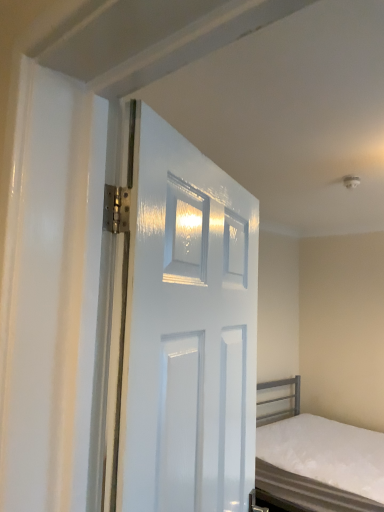
Describe the element at coordinates (186, 329) in the screenshot. I see `white glossy door at center` at that location.

Where is `white glossy door at center`? Image resolution: width=384 pixels, height=512 pixels. white glossy door at center is located at coordinates (186, 329).

Locate an element on the screen. white matte bed at lower right is located at coordinates (313, 457).

What do you see at coordinates (313, 457) in the screenshot? I see `white matte bed at lower right` at bounding box center [313, 457].

Where is `white glossy door at center`? white glossy door at center is located at coordinates click(x=186, y=329).

Considering the positions of objects white matte bed at lower right and white glossy door at center in the image provided, who is more to the left, white matte bed at lower right or white glossy door at center?

From the viewer's perspective, white glossy door at center appears more on the left side.

Considering the relative positions of white matte bed at lower right and white glossy door at center in the image provided, is white matte bed at lower right behind white glossy door at center?

Yes, white matte bed at lower right is behind white glossy door at center.

Is point (285, 461) farther from viewer compared to point (128, 164)?

Yes, it is behind point (128, 164).

From the image's perspective, is white matte bed at lower right located beneath white glossy door at center?

Yes, from the image's perspective, white matte bed at lower right is beneath white glossy door at center.

From a real-world perspective, who is located higher, white matte bed at lower right or white glossy door at center?

In real-world perspective, white glossy door at center is above.

Between white matte bed at lower right and white glossy door at center, which one has smaller width?

Thinner between the two is white glossy door at center.

Can you confirm if white matte bed at lower right is shorter than white glossy door at center?

Correct, white matte bed at lower right is not as tall as white glossy door at center.

Which of these two, white matte bed at lower right or white glossy door at center, is bigger?

With larger size is white matte bed at lower right.

Would you say white matte bed at lower right contains white glossy door at center?

No.

Is the surface of white matte bed at lower right in direct contact with white glossy door at center?

No, white matte bed at lower right is not with white glossy door at center.

Is white matte bed at lower right looking in the opposite direction of white glossy door at center?

That's not correct — white matte bed at lower right is not looking away from white glossy door at center.

How far apart are white matte bed at lower right and white glossy door at center?

white matte bed at lower right and white glossy door at center are 2.25 meters apart from each other.

At what (x,y) coordinates should I click in order to perform the action: click on bed behind the white glossy door at center. Please return your answer as a coordinate pair (x, y). Image resolution: width=384 pixels, height=512 pixels. Looking at the image, I should click on (313, 457).

Is white glossy door at center to the left or to the right of white matte bed at lower right in the image?

Based on their positions, white glossy door at center is located to the left of white matte bed at lower right.

Relative to white matte bed at lower right, is white glossy door at center in front or behind?

white glossy door at center is in front of white matte bed at lower right.

Which is in front, point (192, 246) or point (317, 501)?

The point (192, 246) is closer.

From the image's perspective, would you say white glossy door at center is shown under white matte bed at lower right?

Actually, white glossy door at center appears above white matte bed at lower right in the image.

From a real-world perspective, is white glossy door at center above or below white matte bed at lower right?

white glossy door at center is above white matte bed at lower right.

Does white glossy door at center have a greater width compared to white matte bed at lower right?

In fact, white glossy door at center might be narrower than white matte bed at lower right.

Is white glossy door at center taller or shorter than white matte bed at lower right?

In the image, white glossy door at center appears to be taller than white matte bed at lower right.

Considering the sizes of objects white glossy door at center and white matte bed at lower right in the image provided, who is smaller, white glossy door at center or white matte bed at lower right?

Smaller between the two is white glossy door at center.

Is white glossy door at center completely or partially outside of white matte bed at lower right?

Yes.

Is the surface of white glossy door at center in direct contact with white matte bed at lower right?

white glossy door at center and white matte bed at lower right are not in contact.

Consider the image. Is white glossy door at center turned away from white matte bed at lower right?

No.

Where is `door in front of the white matte bed at lower right`? This screenshot has height=512, width=384. door in front of the white matte bed at lower right is located at coordinates (186, 329).

Locate an element on the screen. The width and height of the screenshot is (384, 512). door that appears above the white matte bed at lower right (from a real-world perspective) is located at coordinates (186, 329).

Where is `bed to the right of white glossy door at center`? bed to the right of white glossy door at center is located at coordinates (313, 457).